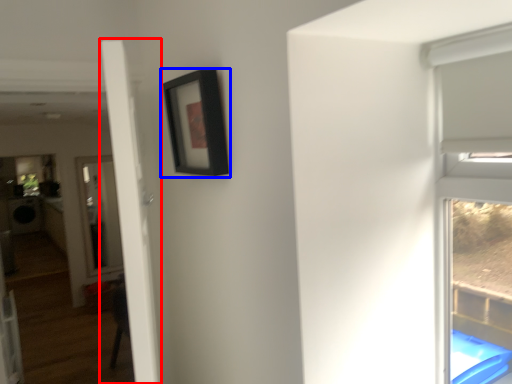
Question: Which of the following is the farthest to the observer, door (highlighted by a red box) or picture frame (highlighted by a blue box)?

Choices:
 (A) door
 (B) picture frame

Answer: (B)